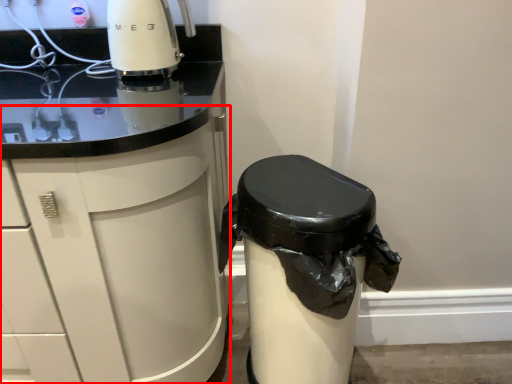
Question: From the image's perspective, where is cabinetry (annotated by the red box) located in relation to waste container in the image?

Choices:
 (A) above
 (B) below

Answer: (A)